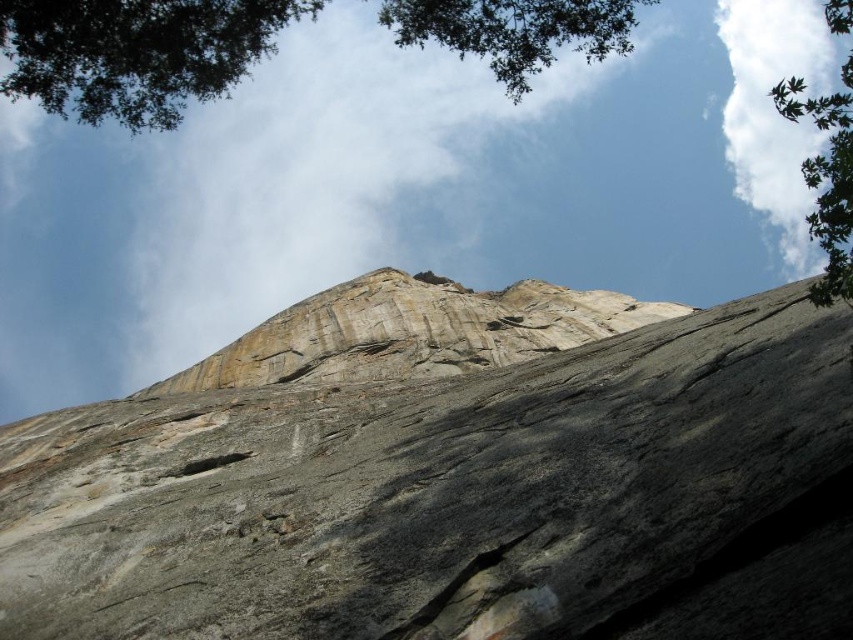
Question: Which object is positioned farthest from the green leafy tree at upper right?

Choices:
 (A) gray/rough rock face at center
 (B) green leafy tree at upper center

Answer: (B)

Question: Can you confirm if gray/rough rock face at center is wider than green leafy tree at upper center?

Choices:
 (A) no
 (B) yes

Answer: (A)

Question: Is gray/rough rock face at center further to the viewer compared to green leafy tree at upper center?

Choices:
 (A) no
 (B) yes

Answer: (A)

Question: Based on their relative distances, which object is farther from the gray/rough rock face at center?

Choices:
 (A) green leafy tree at upper center
 (B) green leafy tree at upper right

Answer: (B)

Question: Which point is farther from the camera taking this photo?

Choices:
 (A) (837, 182)
 (B) (10, 84)
 (C) (378, 422)

Answer: (C)

Question: Does green leafy tree at upper center lie in front of green leafy tree at upper right?

Choices:
 (A) no
 (B) yes

Answer: (A)